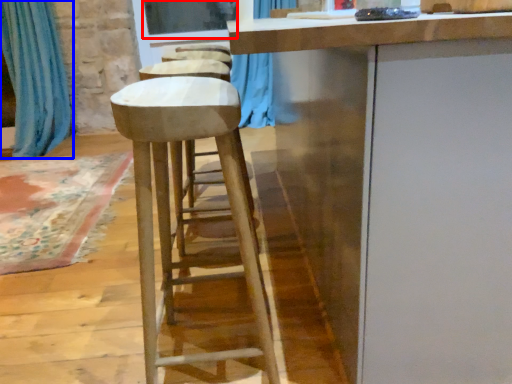
Question: Which of the following is the closest to the observer, window screen (highlighted by a red box) or curtain (highlighted by a blue box)?

Choices:
 (A) window screen
 (B) curtain

Answer: (B)